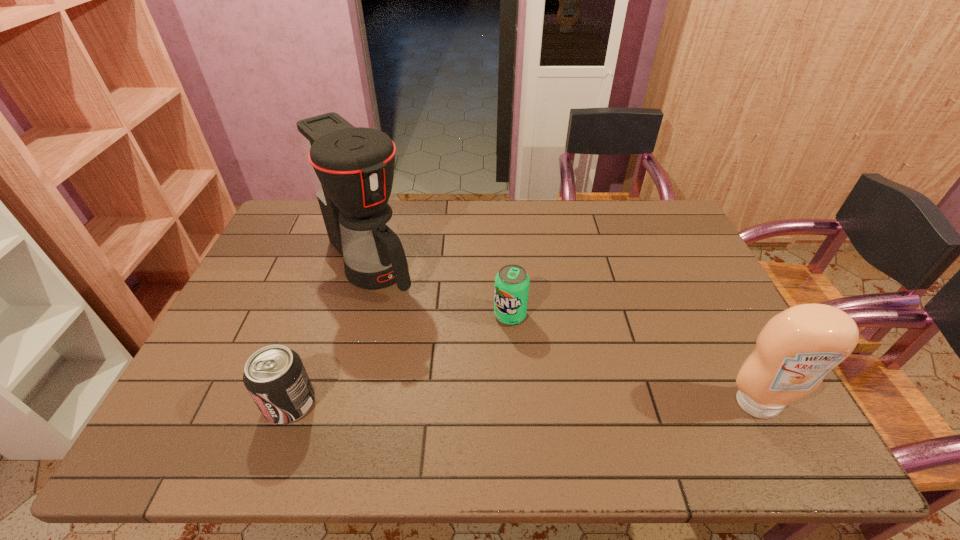
Where is `free space between the left pop soda and the right pop soda`? free space between the left pop soda and the right pop soda is located at coordinates (400, 359).

I want to click on vacant area that lies between the right pop soda and the left pop soda, so click(400, 359).

Where is `object that stands as the third closest to the nearer pop soda`? Image resolution: width=960 pixels, height=540 pixels. object that stands as the third closest to the nearer pop soda is located at coordinates (796, 349).

This screenshot has height=540, width=960. Find the location of `object that is the second closest to the coffee maker`. object that is the second closest to the coffee maker is located at coordinates (275, 377).